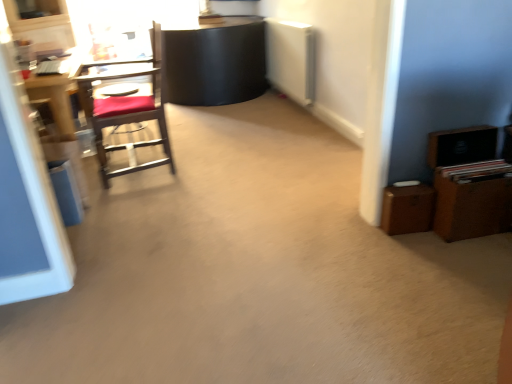
Question: In the image, is wooden desk at left positioned in front of or behind brown wooden dresser at right?

Choices:
 (A) front
 (B) behind

Answer: (B)

Question: Looking at the image, does wooden desk at left seem bigger or smaller compared to brown wooden dresser at right?

Choices:
 (A) small
 (B) big

Answer: (B)

Question: Estimate the real-world distances between objects in this image. Which object is closer to the wooden desk at left?

Choices:
 (A) wooden chair with red cushion at left
 (B) brown wooden dresser at right

Answer: (A)

Question: Which is farther from the brown wooden dresser at right?

Choices:
 (A) wooden desk at left
 (B) wooden chair with red cushion at left

Answer: (A)